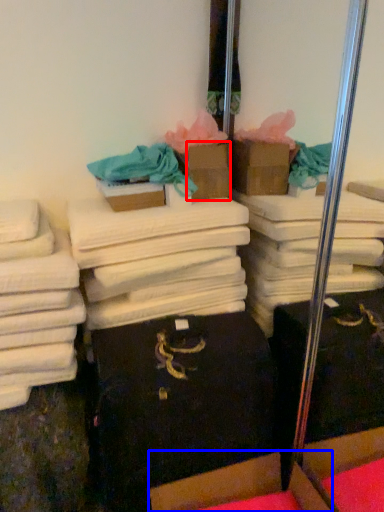
Question: Which object is further to the camera taking this photo, cardboard box (highlighted by a red box) or cardboard box (highlighted by a blue box)?

Choices:
 (A) cardboard box
 (B) cardboard box

Answer: (A)